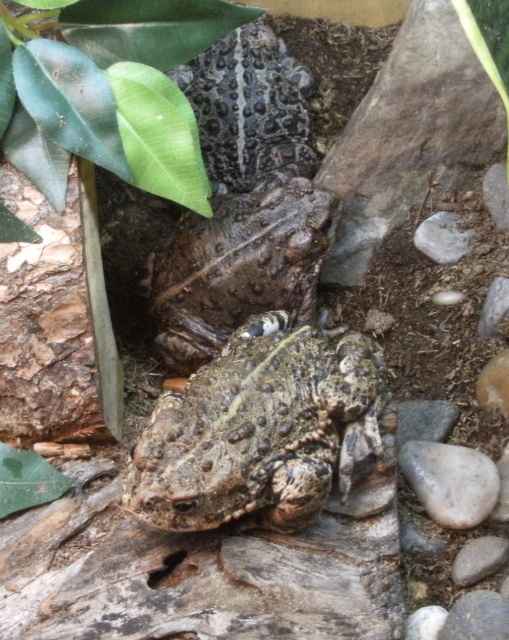
Question: Can you confirm if green matte leaf at upper left is positioned below spotted brown skin at center?

Choices:
 (A) no
 (B) yes

Answer: (A)

Question: Can you confirm if speckled brown frog at center is positioned below spotted brown skin at center?

Choices:
 (A) no
 (B) yes

Answer: (B)

Question: Does spotted brown skin at center appear on the left side of speckled rough skin at center?

Choices:
 (A) yes
 (B) no

Answer: (A)

Question: Which is farther from the speckled brown frog at center?

Choices:
 (A) speckled rough skin at center
 (B) green matte leaf at upper left
 (C) spotted brown skin at center

Answer: (A)

Question: Which is farther from the green matte leaf at upper left?

Choices:
 (A) speckled brown frog at center
 (B) speckled rough skin at center

Answer: (B)

Question: Which point appears farthest from the camera in this image?

Choices:
 (A) (129, 152)
 (B) (494, 493)
 (C) (299, 296)
 (D) (150, 456)

Answer: (C)